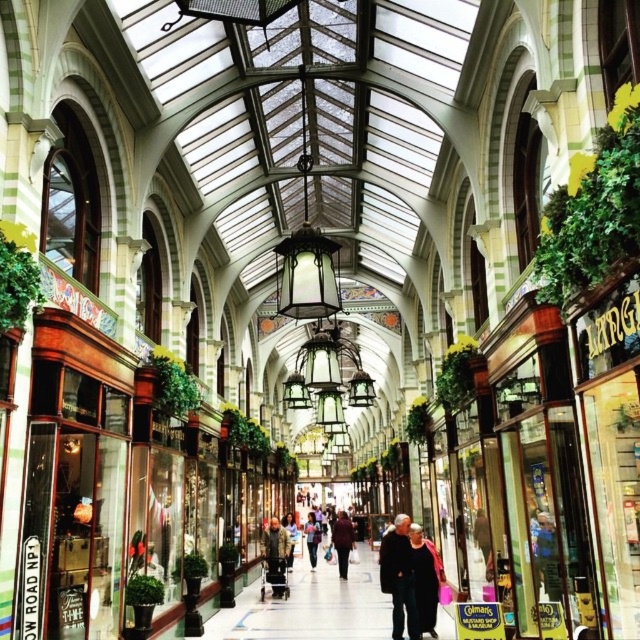
From the picture: Which of these two, dark gray coat at center or dark red sweater at center, stands taller?

dark red sweater at center

Based on the photo, who is lower down, dark gray coat at center or dark red sweater at center?

Positioned lower is dark red sweater at center.

This screenshot has width=640, height=640. Describe the element at coordinates (426, 579) in the screenshot. I see `dark gray coat at center` at that location.

This screenshot has width=640, height=640. In order to click on dark gray coat at center in this screenshot , I will do `click(426, 579)`.

Is point (403, 524) farther from camera compared to point (435, 627)?

Yes, point (403, 524) is behind point (435, 627).

Which is above, dark wool coat at center or dark gray coat at center?

Positioned higher is dark gray coat at center.

The height and width of the screenshot is (640, 640). I want to click on dark wool coat at center, so click(x=397, y=577).

Is point (410, 540) behind point (268, 564)?

No, it is in front of (268, 564).

Can you confirm if dark gray coat at center is thinner than camouflage jacket at center?

Indeed, dark gray coat at center has a lesser width compared to camouflage jacket at center.

Which is behind, point (417, 577) or point (285, 548)?

Point (285, 548)

The width and height of the screenshot is (640, 640). I want to click on dark gray coat at center, so click(x=426, y=579).